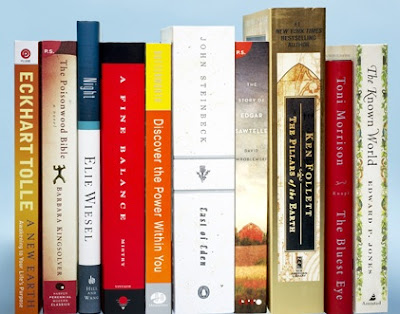
Find the location of `books`. books is located at coordinates (31, 162), (57, 135), (86, 121), (133, 123), (215, 174), (162, 165), (258, 180), (341, 180), (374, 179).